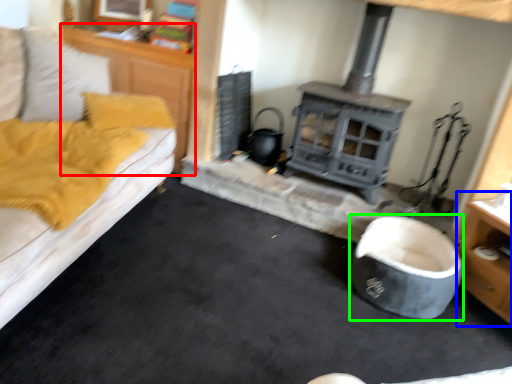
Question: Considering the real-world distances, which object is farthest from dresser (highlighted by a red box)? dresser (highlighted by a blue box) or bean bag chair (highlighted by a green box)?

Choices:
 (A) dresser
 (B) bean bag chair

Answer: (A)